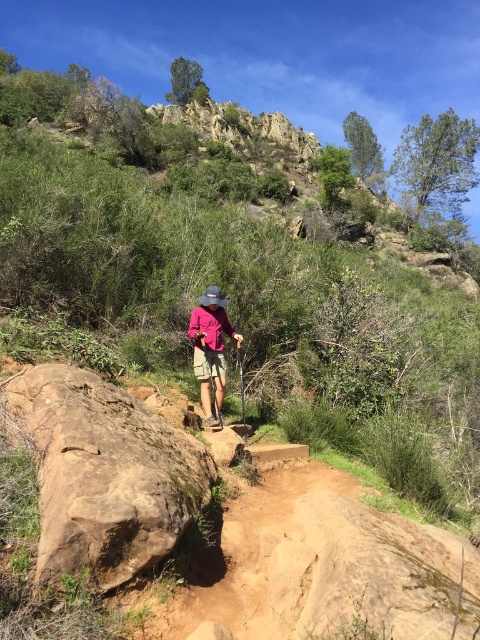
You are a hiker trying to avoid stepping on the brown rough rock at lower left while approaching the pink fabric hat at center. Which object should you adjust your path to go around?

The brown rough rock at lower left is shorter than the pink fabric hat at center, so you should adjust your path around the brown rough rock at lower left since it is lower and easier to navigate around.

You are the hiker in the image and need to place your trekking pole on the ground near the brown rough rock at lower left. Based on its position, where should you place it relative to your current position?

The brown rough rock at lower left is located at point (x=104, y=474), so you should place your trekking pole to the lower left of your current position near the brown rough rock at lower left.